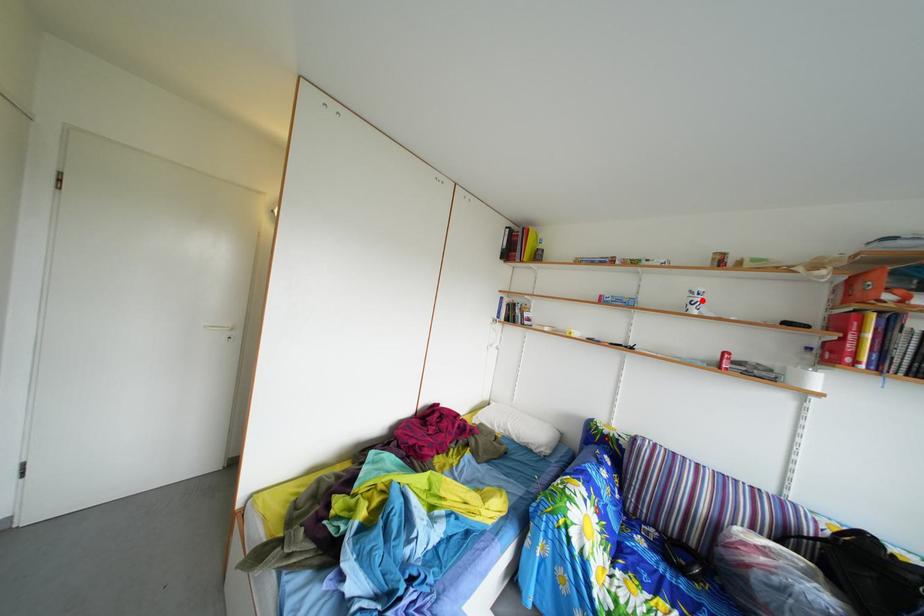
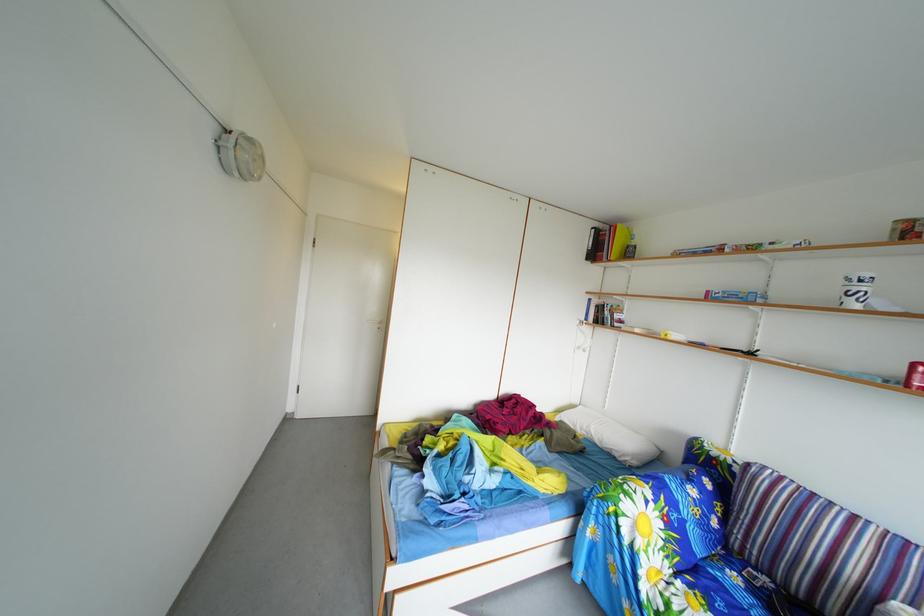
Question: I am providing you with two images of the same scene from different viewpoints. In image1, a red point is highlighted. Considering the same 3D point in image2, which of the following is correct?

Choices:
 (A) It is closer
 (B) It is farther

Answer: (B)